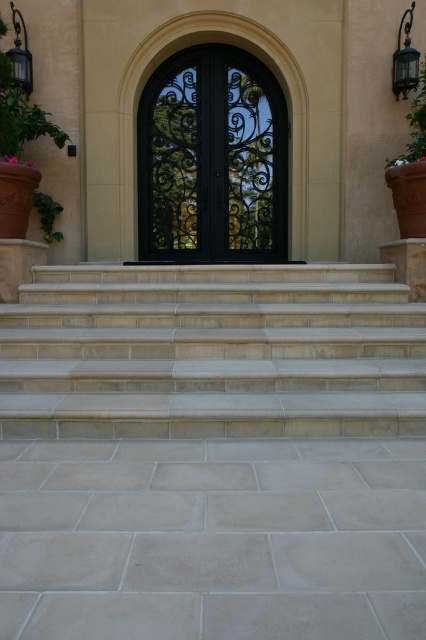
Question: Does black wrought iron door at center come in front of green leafy plant at left?

Choices:
 (A) no
 (B) yes

Answer: (A)

Question: Which point is farther to the camera?

Choices:
 (A) green leafy plant at upper right
 (B) black wrought iron door at center

Answer: (B)

Question: Among these points, which one is nearest to the camera?

Choices:
 (A) (226, 157)
 (B) (46, 400)
 (C) (54, 204)
 (D) (417, 96)

Answer: (B)

Question: Which of these objects is positioned closest to the green leafy plant at upper right?

Choices:
 (A) black wrought iron door at center
 (B) green leafy plant at left
 (C) beige stone stairs at center

Answer: (A)

Question: Does black wrought iron door at center appear over green leafy plant at left?

Choices:
 (A) yes
 (B) no

Answer: (A)

Question: Considering the relative positions of green leafy plant at upper right and green leafy plant at left in the image provided, where is green leafy plant at upper right located with respect to green leafy plant at left?

Choices:
 (A) right
 (B) left

Answer: (A)